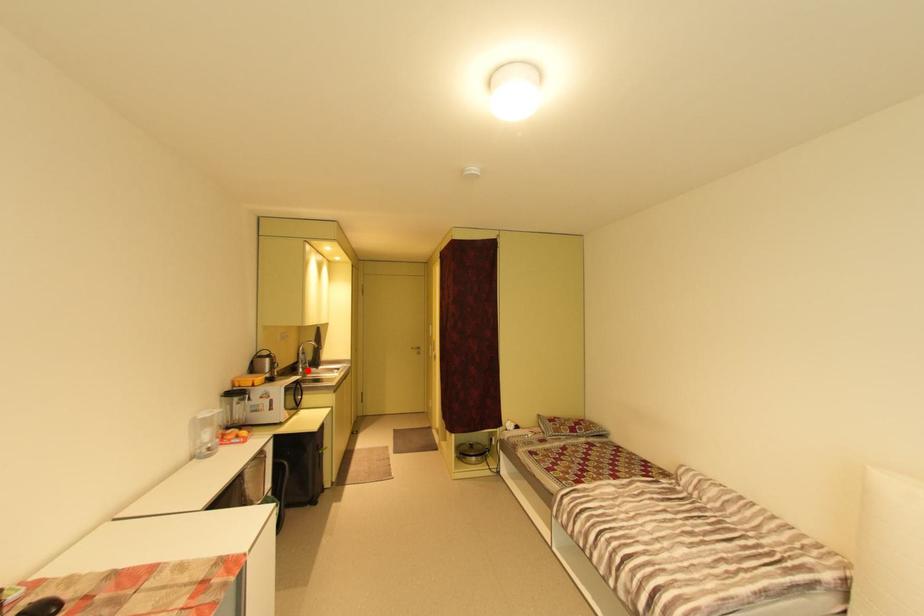
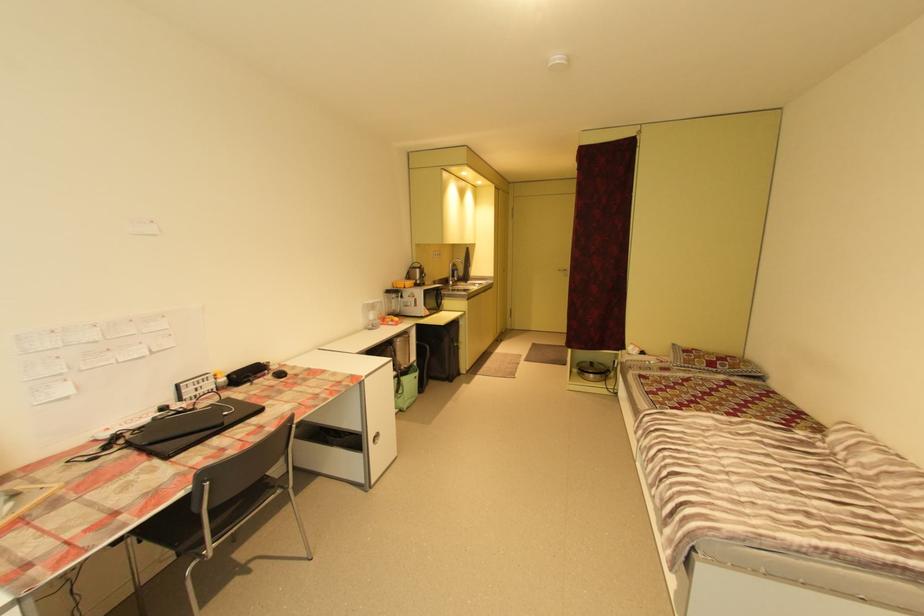
Question: I am providing you with two images of the same scene from different viewpoints. In image1, a red point is highlighted. Considering the same 3D point in image2, which of the following is correct?

Choices:
 (A) It is closer
 (B) It is farther

Answer: (A)